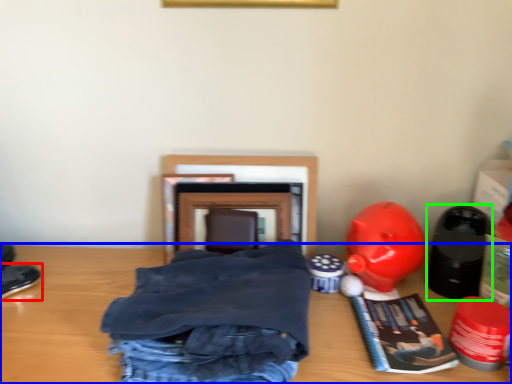
Question: Based on their relative distances, which object is farther from footwear (highlighted by a red box)? Choose from table (highlighted by a blue box) and toy (highlighted by a green box).

Choices:
 (A) table
 (B) toy

Answer: (B)